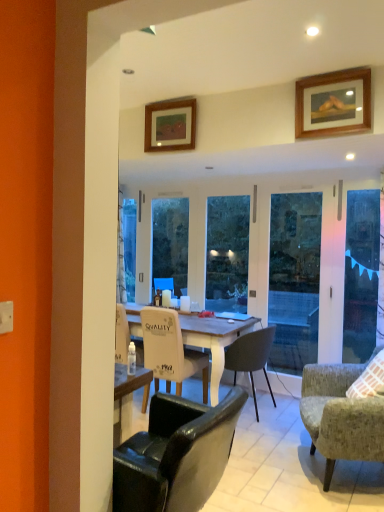
Question: Is white glossy coffee cup at center, which is the first coffee cup in left-to-right order, beside transparent glass screen door at right?

Choices:
 (A) yes
 (B) no

Answer: (B)

Question: Would you say white glossy coffee cup at center, which is the first coffee cup in left-to-right order, is outside transparent glass screen door at right?

Choices:
 (A) yes
 (B) no

Answer: (A)

Question: From the image's perspective, does white glossy coffee cup at center, the 3th coffee cup from the right, appear lower than transparent glass screen door at right?

Choices:
 (A) yes
 (B) no

Answer: (A)

Question: Is white glossy coffee cup at center, which is the first coffee cup in left-to-right order, facing away from transparent glass screen door at right?

Choices:
 (A) no
 (B) yes

Answer: (A)

Question: Can you confirm if white glossy coffee cup at center, which is the first coffee cup in left-to-right order, is taller than transparent glass screen door at right?

Choices:
 (A) yes
 (B) no

Answer: (B)

Question: Considering their positions, is white glossy coffee cup at center, which is the first coffee cup in left-to-right order, located in front of or behind wooden picture frame at upper right, acting as the 2th picture frame starting from the back?

Choices:
 (A) behind
 (B) front

Answer: (A)

Question: Would you say white glossy coffee cup at center, which is the first coffee cup in left-to-right order, is to the left or to the right of wooden picture frame at upper right, the first picture frame when ordered from right to left, in the picture?

Choices:
 (A) left
 (B) right

Answer: (A)

Question: Considering the positions of point (167, 293) and point (324, 77), is point (167, 293) closer or farther from the camera than point (324, 77)?

Choices:
 (A) farther
 (B) closer

Answer: (A)

Question: Do you think white glossy coffee cup at center, the 3th coffee cup from the right, is within wooden picture frame at upper right, which appears as the 2th picture frame when viewed from the left, or outside of it?

Choices:
 (A) inside
 (B) outside

Answer: (B)

Question: In the image, is wooden picture frame at upper right, the first picture frame when ordered from right to left, on the left side or the right side of matte white coffee cup at center, arranged as the 1th coffee cup when viewed from the right?

Choices:
 (A) right
 (B) left

Answer: (A)

Question: Considering the positions of point (342, 105) and point (193, 305), is point (342, 105) closer or farther from the camera than point (193, 305)?

Choices:
 (A) closer
 (B) farther

Answer: (A)

Question: Is wooden picture frame at upper right, acting as the 2th picture frame starting from the back, situated inside matte white coffee cup at center, which is the third coffee cup in left-to-right order, or outside?

Choices:
 (A) outside
 (B) inside

Answer: (A)

Question: From the image's perspective, is wooden picture frame at upper right, the first picture frame when ordered from right to left, located above or below matte white coffee cup at center, which is the third coffee cup in left-to-right order?

Choices:
 (A) below
 (B) above

Answer: (B)

Question: Looking at their shapes, would you say matte black chair at center, the first chair when ordered from back to front, is wider or thinner than matte white coffee cup at center, which is the third coffee cup in left-to-right order?

Choices:
 (A) thin
 (B) wide

Answer: (B)

Question: Considering the positions of matte black chair at center, which is the 4th chair from front to back, and matte white coffee cup at center, arranged as the 1th coffee cup when viewed from the right, in the image, is matte black chair at center, which is the 4th chair from front to back, taller or shorter than matte white coffee cup at center, arranged as the 1th coffee cup when viewed from the right,?

Choices:
 (A) tall
 (B) short

Answer: (A)